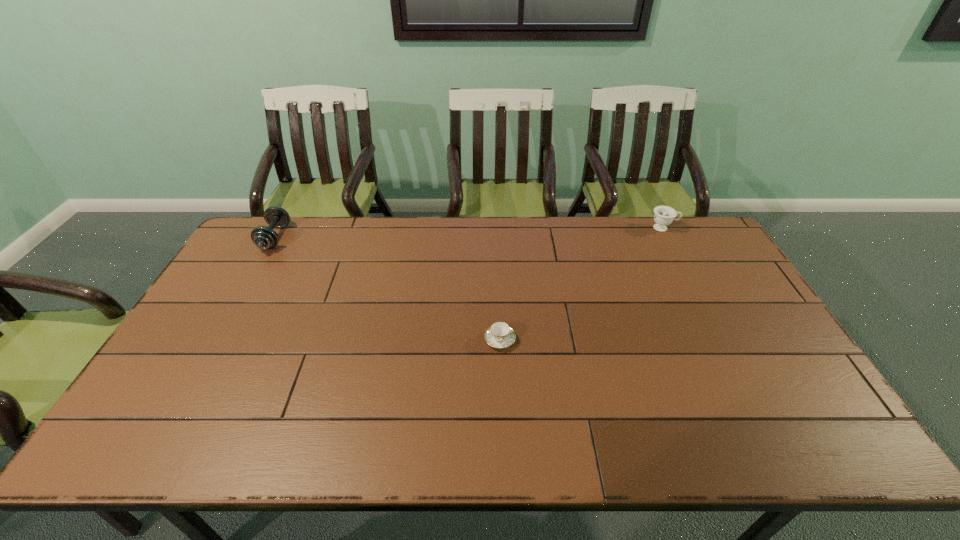
This screenshot has height=540, width=960. I want to click on object that is the closest one to the left teacup, so click(x=664, y=215).

Locate an element on the screen. free location that satisfies the following two spatial constraints: 1. on the side of the taller teacup with the handle; 2. on the side with the handle of the nearer teacup is located at coordinates (722, 340).

Identify the location of free space that satisfies the following two spatial constraints: 1. on the side of the second shortest object with the handle; 2. on the side with the handle of the shorter teacup. This screenshot has width=960, height=540. (722, 340).

You are a GUI agent. You are given a task and a screenshot of the screen. Output one action in this format:
    pyautogui.click(x=<x>, y=<y>)
    Task: Click on the vacant space that satisfies the following two spatial constraints: 1. on the side of the rightmost object with the handle; 2. on the side with the handle of the nearer teacup
    This screenshot has width=960, height=540.
    Given the screenshot: What is the action you would take?
    pyautogui.click(x=722, y=340)

Where is `free space that satisfies the following two spatial constraints: 1. on the side of the farther teacup with the handle; 2. on the side with the handle of the shortest object`? free space that satisfies the following two spatial constraints: 1. on the side of the farther teacup with the handle; 2. on the side with the handle of the shortest object is located at coordinates (722, 340).

I want to click on vacant region that satisfies the following two spatial constraints: 1. on the side of the farther teacup with the handle; 2. on the side with the handle of the nearest object, so click(722, 340).